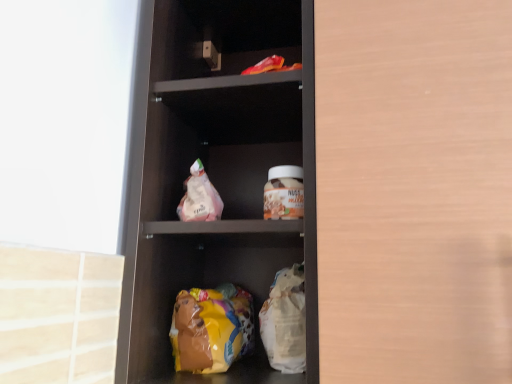
Question: Is the surface of matte plastic shelf at center in direct contact with translucent plastic bag at center?

Choices:
 (A) no
 (B) yes

Answer: (A)

Question: Could you tell me if matte plastic shelf at center is turned towards translucent plastic bag at center?

Choices:
 (A) yes
 (B) no

Answer: (A)

Question: Would you say translucent plastic bag at center is part of matte plastic shelf at center's contents?

Choices:
 (A) yes
 (B) no

Answer: (A)

Question: Can you confirm if matte plastic shelf at center is wider than translucent plastic bag at center?

Choices:
 (A) no
 (B) yes

Answer: (B)

Question: Is matte plastic shelf at center in front of translucent plastic bag at center?

Choices:
 (A) no
 (B) yes

Answer: (B)

Question: From the image's perspective, is wooden cabinet door at right above or below matte plastic shelf at center?

Choices:
 (A) below
 (B) above

Answer: (B)

Question: Relative to matte plastic shelf at center, is wooden cabinet door at right in front or behind?

Choices:
 (A) behind
 (B) front

Answer: (B)

Question: Is wooden cabinet door at right taller or shorter than matte plastic shelf at center?

Choices:
 (A) short
 (B) tall

Answer: (A)

Question: Considering the positions of point (366, 129) and point (139, 253), is point (366, 129) closer or farther from the camera than point (139, 253)?

Choices:
 (A) farther
 (B) closer

Answer: (B)

Question: Based on their sizes in the image, would you say translucent plastic bag at center is bigger or smaller than yellow plastic bag at lower center?

Choices:
 (A) big
 (B) small

Answer: (B)

Question: From the image's perspective, is translucent plastic bag at center above or below yellow plastic bag at lower center?

Choices:
 (A) below
 (B) above

Answer: (B)

Question: Is translucent plastic bag at center spatially inside yellow plastic bag at lower center, or outside of it?

Choices:
 (A) inside
 (B) outside

Answer: (B)

Question: Visually, is translucent plastic bag at center positioned to the left or to the right of yellow plastic bag at lower center?

Choices:
 (A) left
 (B) right

Answer: (A)

Question: From the image's perspective, relative to matte brown glass jar at center, is matte plastic shelf at center above or below?

Choices:
 (A) below
 (B) above

Answer: (B)

Question: Considering the relative positions of matte plastic shelf at center and matte brown glass jar at center in the image provided, is matte plastic shelf at center to the left or to the right of matte brown glass jar at center?

Choices:
 (A) right
 (B) left

Answer: (B)